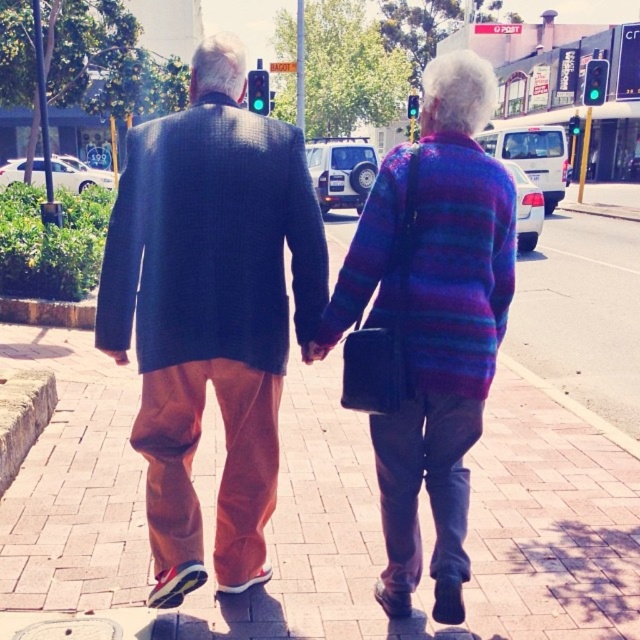
You are a photographer trying to capture the couple in the scene. You want to focus on the textured navy blazer at center and the purple striped sweater at center. Which clothing item is covering part of the other?

The textured navy blazer at center is positioned over the purple striped sweater at center, so it is covering part of the purple striped sweater at center.

Based on the photo, please provide the coordinates of the textured navy blazer at center in the image. The answer should be in the format of coordinates in parentheses, like this example format. The scene is a sidewalk in a suburban or urban setting with two elderly individuals walking hand in hand. The man is wearing a dark, textured blazer over a collared shirt, orange trousers, and black sneakers with red accents. The woman is wearing a vibrant multicolored striped sweater and gray pants. They are on a reddish brown brick h

The coordinates of the textured navy blazer at center are at point (211, 310).

You are a photographer standing on the sidewalk capturing a photo of the elderly couple. Which object, the brick pavement at center or the purple striped sweater at center, will appear larger in your photo?

The brick pavement at center will appear larger in the photo because it is closer to the viewer than the purple striped sweater at center.